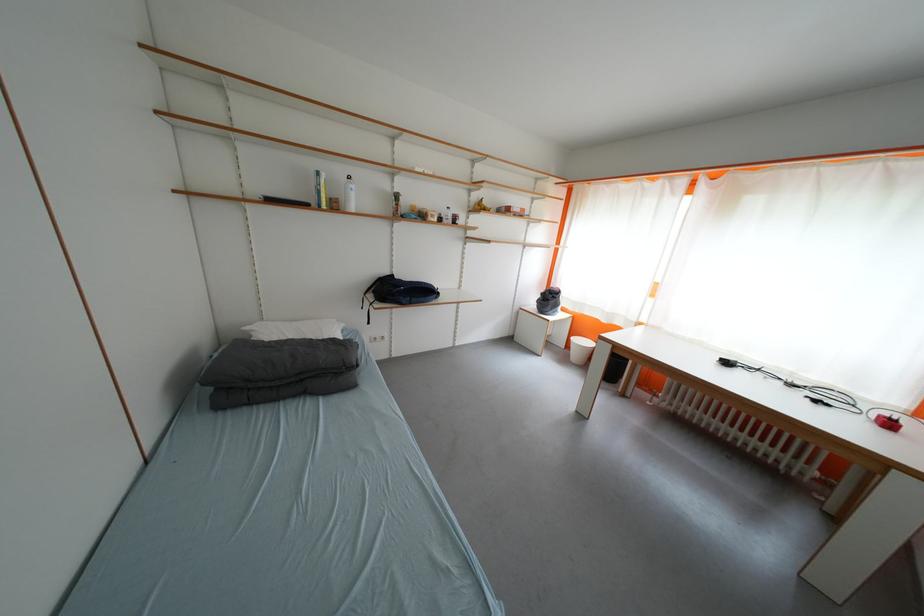
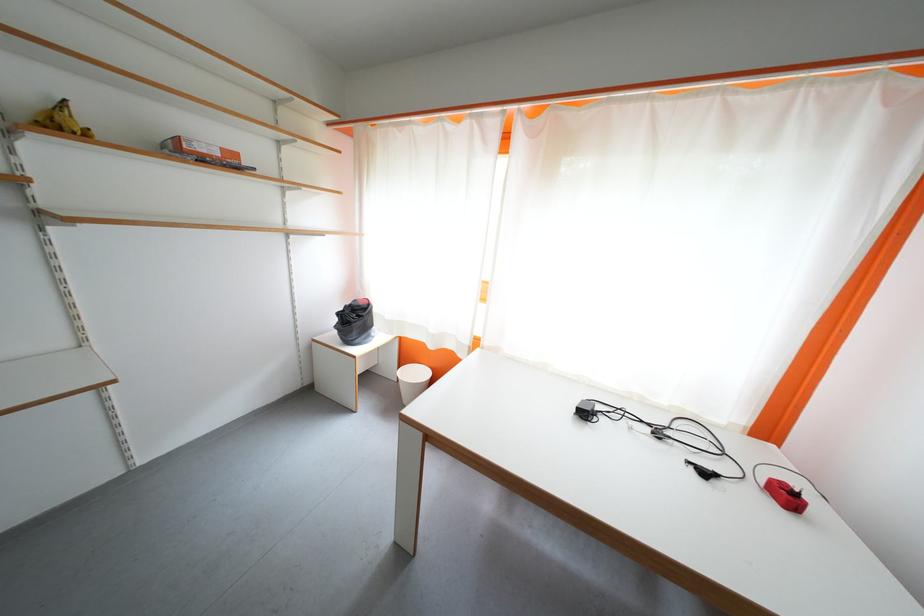
Locate, in the second image, the point that corresponds to [488,211] in the first image.

(68, 129)